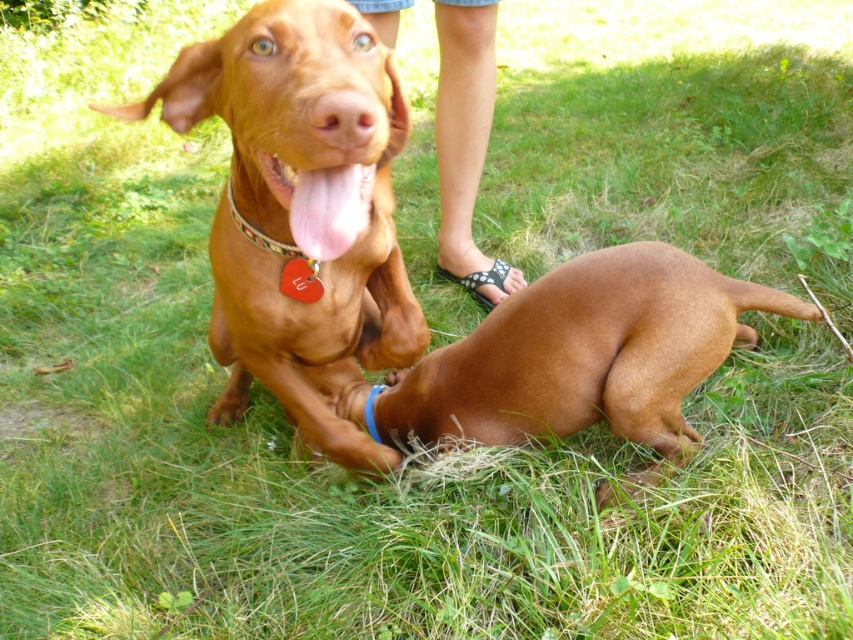
Question: Which object appears farthest from the camera in this image?

Choices:
 (A) shiny brown dog at center
 (B) smooth tan skin at center
 (C) brown smooth dog at lower center
 (D) red heart-shaped tag at center

Answer: (B)

Question: Estimate the real-world distances between objects in this image. Which object is farther from the blue rubber band at center?

Choices:
 (A) smooth tan skin at center
 (B) pink glossy tongue at center

Answer: (B)

Question: Among these points, which one is farthest from the camera?

Choices:
 (A) (274, 157)
 (B) (477, 81)

Answer: (B)

Question: Is shiny brown dog at center behind smooth tan skin at center?

Choices:
 (A) yes
 (B) no

Answer: (B)

Question: Does smooth tan skin at center come in front of pink glossy tongue at center?

Choices:
 (A) yes
 (B) no

Answer: (B)

Question: Does pink glossy tongue at center appear on the right side of blue rubber band at center?

Choices:
 (A) yes
 (B) no

Answer: (B)